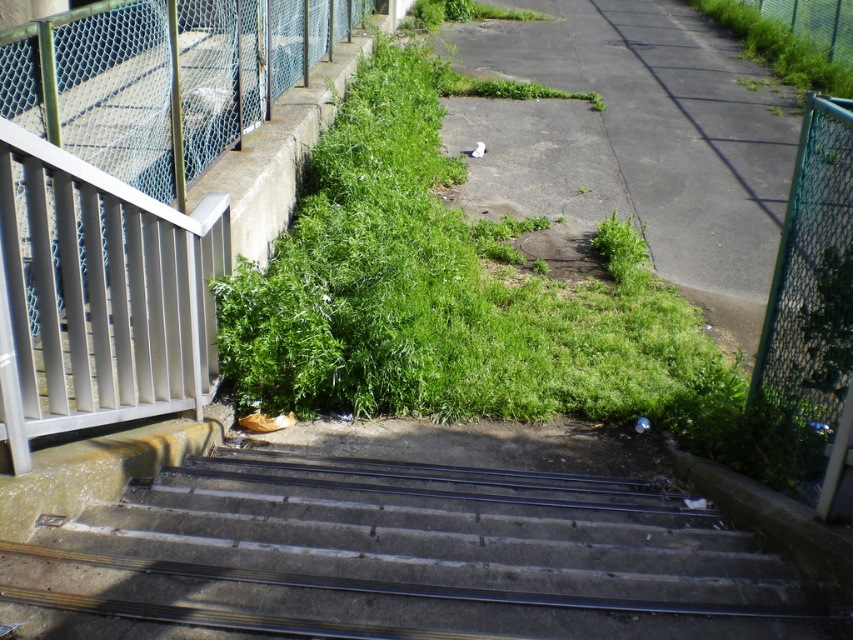
Question: Can you confirm if green grass at upper right is positioned to the left of green leafy weed at center?

Choices:
 (A) no
 (B) yes

Answer: (A)

Question: Which object appears closest to the camera in this image?

Choices:
 (A) green leafy weed at center
 (B) concrete stairs at center
 (C) green grass at upper right
 (D) brushed metal fence at left

Answer: (B)

Question: Can you confirm if green grass at upper right is wider than green leafy weed at center?

Choices:
 (A) yes
 (B) no

Answer: (B)

Question: Estimate the real-world distances between objects in this image. Which object is closer to the green leafy weed at center?

Choices:
 (A) concrete stairs at center
 (B) green leafy grass at center

Answer: (B)

Question: Which object is positioned farthest from the green leafy weed at center?

Choices:
 (A) concrete stairs at center
 (B) green grass at upper right
 (C) green leafy grass at center

Answer: (B)

Question: Does concrete stairs at center appear under green mesh fence at right?

Choices:
 (A) yes
 (B) no

Answer: (A)